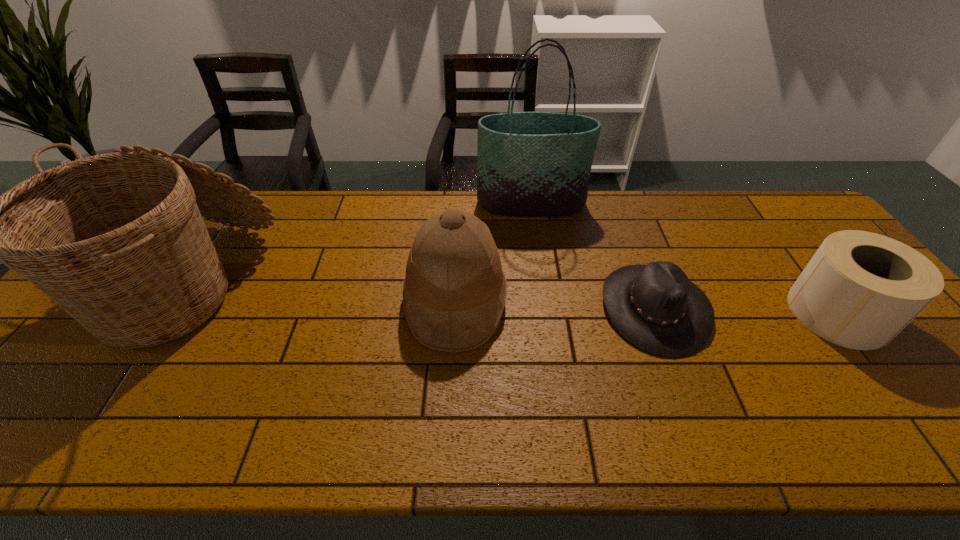
Locate an element on the screen. The width and height of the screenshot is (960, 540). free space located 0.380m on the right of the farthest object is located at coordinates (698, 204).

I want to click on vacant area situated 0.110m on the front of the fourth shortest object, so click(102, 415).

The image size is (960, 540). I want to click on vacant space situated 0.190m on the front-facing side of the taller hat, so click(577, 301).

At what (x,y) coordinates should I click in order to perform the action: click on vacant space situated 0.060m on the back of the toilet tissue. Please return your answer as a coordinate pair (x, y). The width and height of the screenshot is (960, 540). Looking at the image, I should click on (803, 266).

The width and height of the screenshot is (960, 540). Find the location of `free space located 0.220m on the front-facing side of the shortest object`. free space located 0.220m on the front-facing side of the shortest object is located at coordinates (519, 308).

Locate an element on the screen. vacant region located on the front-facing side of the shortest object is located at coordinates (508, 308).

You are a GUI agent. You are given a task and a screenshot of the screen. Output one action in this format:
    pyautogui.click(x=<x>, y=<y>)
    Task: Click on the free point located 0.330m on the front-facing side of the shortest object
    The width and height of the screenshot is (960, 540).
    Given the screenshot: What is the action you would take?
    pyautogui.click(x=477, y=308)

Locate an element on the screen. Image resolution: width=960 pixels, height=540 pixels. tote bag present at the far edge is located at coordinates (533, 164).

I want to click on basket situated at the far edge, so click(117, 240).

This screenshot has width=960, height=540. What are the coordinates of `object at the left edge` in the screenshot? It's located at (117, 240).